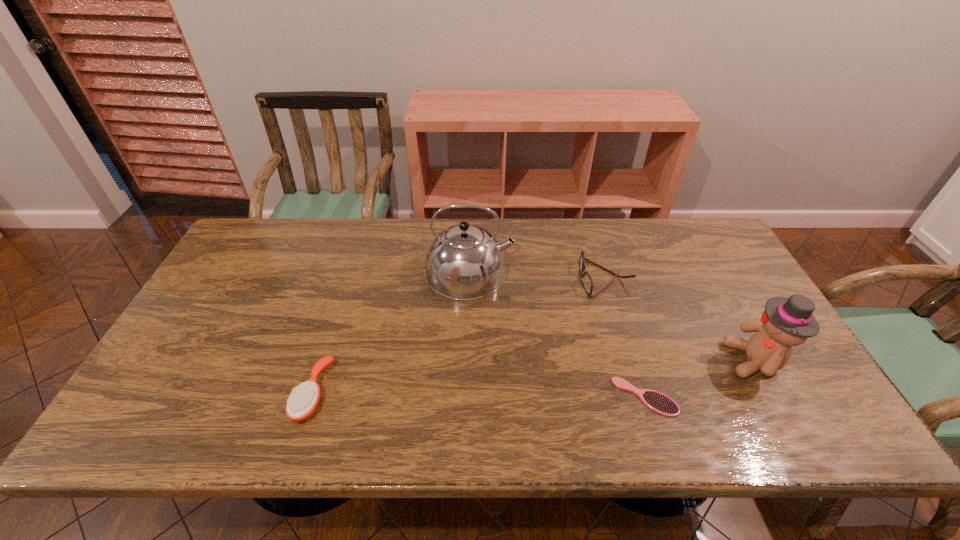
Where is `kettle`? Image resolution: width=960 pixels, height=540 pixels. kettle is located at coordinates (464, 262).

The image size is (960, 540). What are the coordinates of `the second tallest object` in the screenshot? It's located at (786, 322).

Locate an element on the screen. The image size is (960, 540). the rightmost object is located at coordinates (786, 322).

The image size is (960, 540). Find the location of `spectacles`. spectacles is located at coordinates (587, 282).

The height and width of the screenshot is (540, 960). Identify the location of the left hairbrush. (303, 401).

Identify the location of the leftmost object. (303, 401).

Where is `the right hairbrush`? the right hairbrush is located at coordinates coord(658,402).

The height and width of the screenshot is (540, 960). Identify the location of the shorter hairbrush. [658, 402].

Image resolution: width=960 pixels, height=540 pixels. Identify the location of free space located 0.220m from the spout of the kettle. (586, 272).

Locate an element on the screen. This screenshot has height=540, width=960. vacant space situated on the front-facing side of the second tallest object is located at coordinates (676, 360).